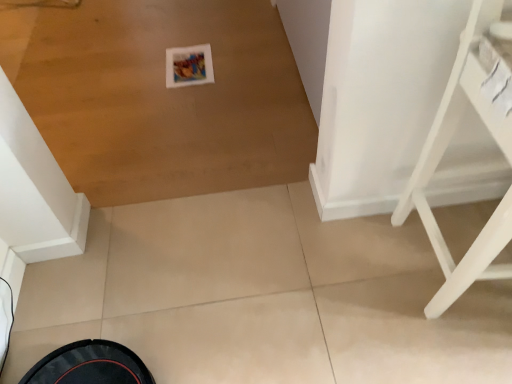
Image resolution: width=512 pixels, height=384 pixels. I want to click on free point below white wood ladder at right (from a real-world perspective), so click(460, 258).